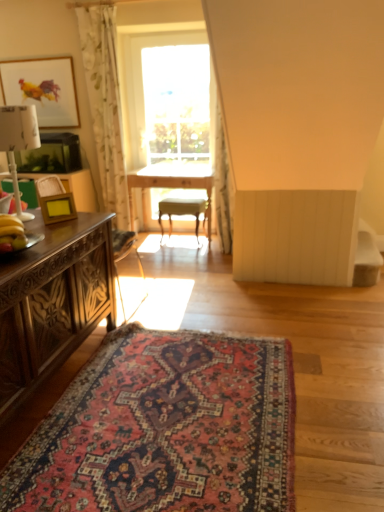
Question: Does yellow matte banana at left appear on the left side of matte wooden picture frame at upper left, which ranks as the 1th picture frame in left-to-right order?

Choices:
 (A) yes
 (B) no

Answer: (B)

Question: From a real-world perspective, is yellow matte banana at left beneath matte wooden picture frame at upper left, the 2th picture frame when ordered from bottom to top?

Choices:
 (A) yes
 (B) no

Answer: (A)

Question: Considering the relative sizes of yellow matte banana at left and matte wooden picture frame at upper left, the first picture frame when ordered from back to front, in the image provided, is yellow matte banana at left shorter than matte wooden picture frame at upper left, the first picture frame when ordered from back to front,?

Choices:
 (A) no
 (B) yes

Answer: (B)

Question: Would you say yellow matte banana at left is outside matte wooden picture frame at upper left, the first picture frame when ordered from back to front?

Choices:
 (A) yes
 (B) no

Answer: (A)

Question: Does yellow matte banana at left lie in front of matte wooden picture frame at upper left, which ranks as the 1th picture frame in left-to-right order?

Choices:
 (A) no
 (B) yes

Answer: (B)

Question: From their relative heights in the image, would you say light yellow wood chair at center is taller or shorter than clear glass window at center?

Choices:
 (A) short
 (B) tall

Answer: (A)

Question: Relative to clear glass window at center, is light yellow wood chair at center in front or behind?

Choices:
 (A) front
 (B) behind

Answer: (B)

Question: From the image's perspective, is light yellow wood chair at center positioned above or below clear glass window at center?

Choices:
 (A) above
 (B) below

Answer: (B)

Question: From a real-world perspective, relative to clear glass window at center, is light yellow wood chair at center vertically above or below?

Choices:
 (A) above
 (B) below

Answer: (B)

Question: From the image's perspective, relative to white fabric lampshade at left, is yellow matte banana at left above or below?

Choices:
 (A) above
 (B) below

Answer: (B)

Question: Is yellow matte banana at left taller or shorter than white fabric lampshade at left?

Choices:
 (A) short
 (B) tall

Answer: (A)

Question: From a real-world perspective, relative to white fabric lampshade at left, is yellow matte banana at left vertically above or below?

Choices:
 (A) below
 (B) above

Answer: (A)

Question: Is yellow matte banana at left in front of or behind white fabric lampshade at left in the image?

Choices:
 (A) behind
 (B) front

Answer: (B)

Question: From the image's perspective, is white floral fabric curtain at upper center, marked as the second curtain in a left-to-right arrangement, positioned above or below matte wooden picture frame at upper left, the second picture frame in the front-to-back sequence?

Choices:
 (A) above
 (B) below

Answer: (B)

Question: In terms of size, does white floral fabric curtain at upper center, positioned as the first curtain in right-to-left order, appear bigger or smaller than matte wooden picture frame at upper left, the 1th picture frame in the top-to-bottom sequence?

Choices:
 (A) big
 (B) small

Answer: (A)